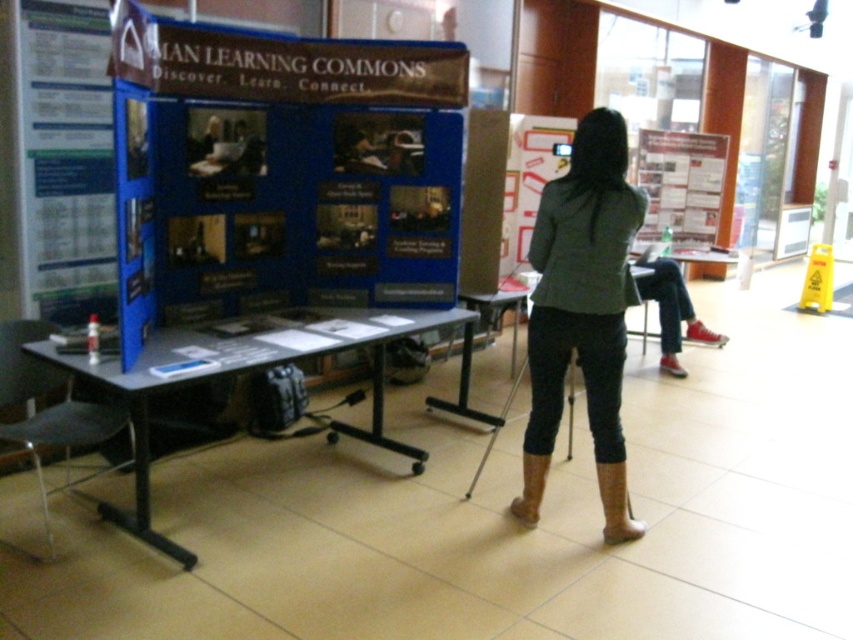
You are organizing an event and need to adjust the display items. The dark gray blazer at center and the matte paper poster at upper right are currently placed in a way that might block important information. Which object is blocking the other?

The dark gray blazer at center is positioned under the matte paper poster at upper right, so the blazer is blocking the poster from full view.

You are organizing an event and need to know which poster takes up more space on the table. Which one is larger in size between the white paper poster at left and the matte paper poster at upper right?

The matte paper poster at upper right is larger in size than the white paper poster at left because it occupies more space.